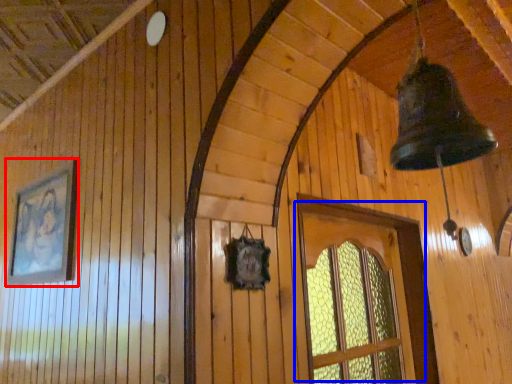
Question: Among these objects, which one is nearest to the camera, picture frame (highlighted by a red box) or window (highlighted by a blue box)?

Choices:
 (A) picture frame
 (B) window

Answer: (B)